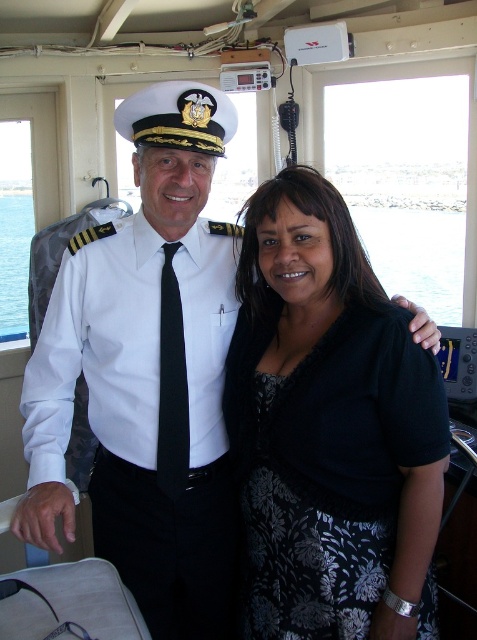
You are a photographer taking a picture of the black floral dress at center and the white cotton shirt at center. Which one appears smaller in the photo?

The black floral dress at center appears smaller in the photo compared to the white cotton shirt at center because it has a smaller size.

You are a photographer trying to capture a photo of the black floral dress at center and the blue water at center from the bridge of the ship. Which object will appear larger in the photo?

The black floral dress at center will appear larger in the photo because it is much taller than the blue water at center.